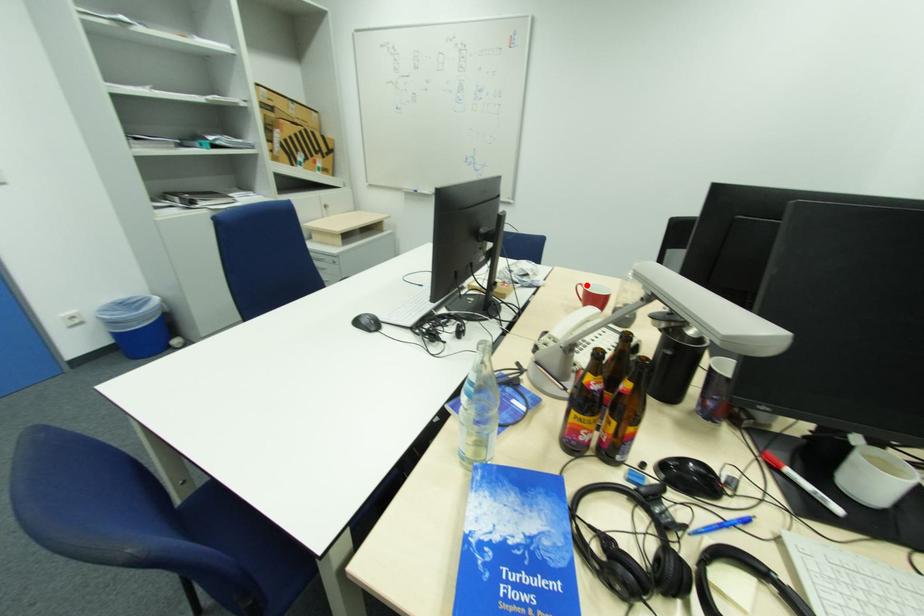
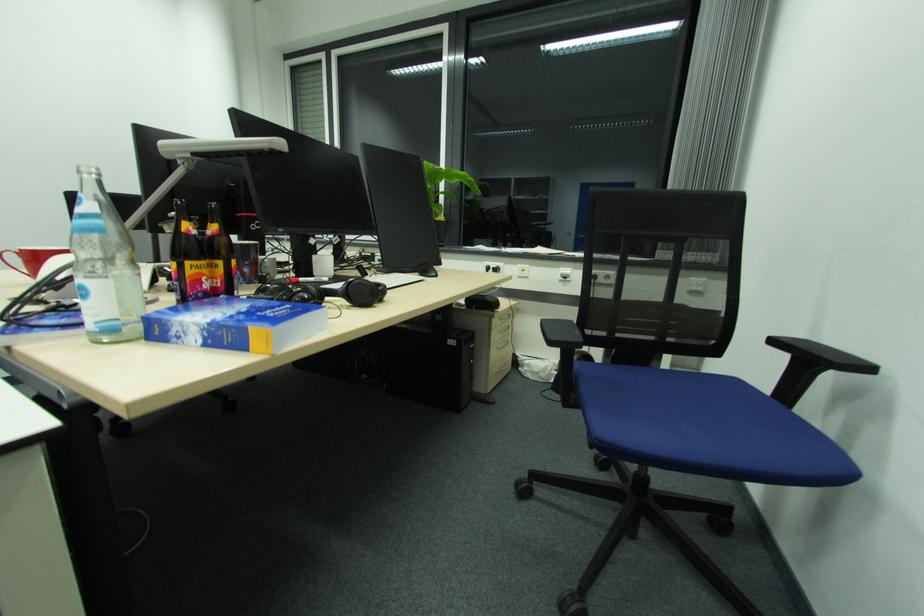
Question: I am providing you with two images of the same scene from different viewpoints. Image1 has a red point marked. In image2, the corresponding 3D location appears at what relative position? Reply with the corresponding letter.

Choices:
 (A) Closer
 (B) Farther

Answer: (B)